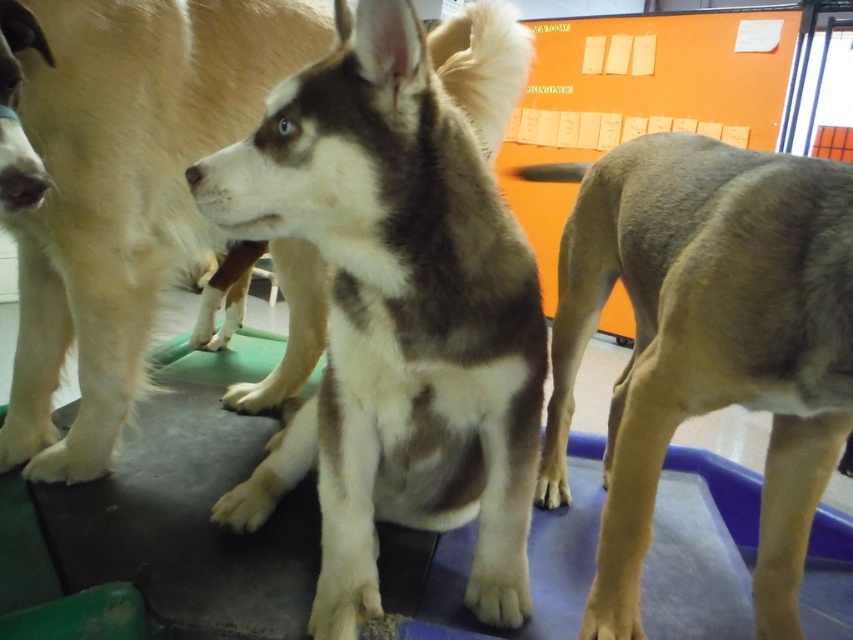
Is brown and white fur at center further to camera compared to brown fur dog at right?

No, brown and white fur at center is in front of brown fur dog at right.

The height and width of the screenshot is (640, 853). Identify the location of brown and white fur at center. (393, 317).